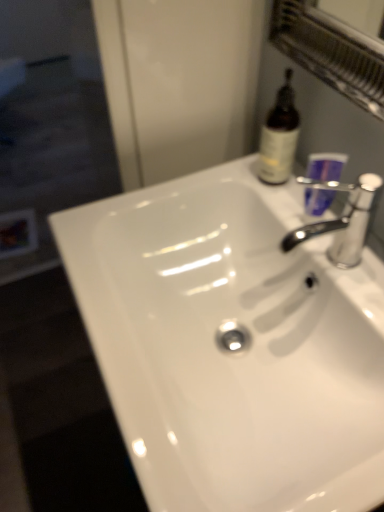
Image resolution: width=384 pixels, height=512 pixels. In order to click on vacant location behind silver metallic faucet at upper right in this screenshot , I will do `click(284, 201)`.